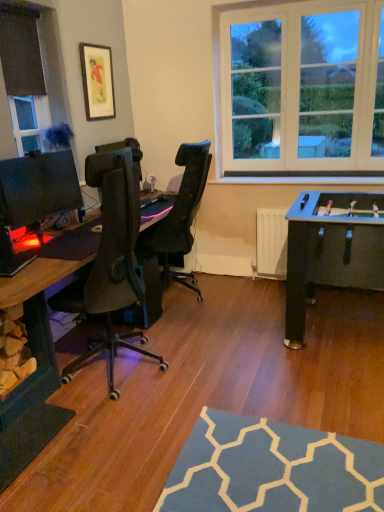
What do you see at coordinates (51, 264) in the screenshot? I see `matte black desk at left` at bounding box center [51, 264].

The image size is (384, 512). I want to click on matte gold picture frame at upper left, so click(x=97, y=81).

At what (x,y) coordinates should I click in order to perform the action: click on matte black monitor at left. Please return your answer as a coordinate pair (x, y). The image size is (384, 512). Looking at the image, I should click on (38, 188).

From a real-world perspective, is matte gold picture frame at upper left positioned under black fabric at upper left based on gravity?

Correct, in the physical world, matte gold picture frame at upper left is lower than black fabric at upper left.

Is matte gold picture frame at upper left aimed at black fabric at upper left?

No, matte gold picture frame at upper left is not aimed at black fabric at upper left.

What's the angular difference between matte gold picture frame at upper left and black fabric at upper left's facing directions?

They differ by 0.252 degrees in their facing directions.

Considering the relative sizes of black fabric at upper left and matte black desk at left in the image provided, is black fabric at upper left smaller than matte black desk at left?

Yes.

Do you think black fabric at upper left is within matte black desk at left, or outside of it?

black fabric at upper left lies outside matte black desk at left.

From the image's perspective, is black fabric at upper left located above or below matte black desk at left?

Clearly, from the image's perspective, black fabric at upper left is above matte black desk at left.

Would you say matte black monitor at left is to the left or to the right of matte black desk at left in the picture?

From the image, it's evident that matte black monitor at left is to the left of matte black desk at left.

Would you consider matte black monitor at left to be distant from matte black desk at left?

No, there isn't a large distance between matte black monitor at left and matte black desk at left.

Would you say matte black monitor at left is outside matte black desk at left?

Yes, matte black monitor at left is located beyond the bounds of matte black desk at left.

Consider the image. Does matte black desk at left have a lesser width compared to matte gold picture frame at upper left?

In fact, matte black desk at left might be wider than matte gold picture frame at upper left.

Between matte black desk at left and matte gold picture frame at upper left, which one is positioned behind?

matte gold picture frame at upper left is further from the camera.

At what (x,y) coordinates should I click in order to perform the action: click on computer desk that is under the matte gold picture frame at upper left (from a real-world perspective). Please return your answer as a coordinate pair (x, y). Looking at the image, I should click on (51, 264).

Is matte black monitor at left oriented towards matte gold picture frame at upper left?

No, matte black monitor at left is not turned towards matte gold picture frame at upper left.

Between matte black monitor at left and matte gold picture frame at upper left, which one has more height?

Standing taller between the two is matte gold picture frame at upper left.

From a real-world perspective, who is located lower, matte black monitor at left or matte gold picture frame at upper left?

matte black monitor at left, from a real-world perspective.

From the image's perspective, between matte black monitor at left and matte gold picture frame at upper left, which one is located above?

matte gold picture frame at upper left, from the image's perspective.

Which of these two, matte gold picture frame at upper left or matte black desk at left, is thinner?

matte gold picture frame at upper left is thinner.

Is matte gold picture frame at upper left closer to camera compared to matte black desk at left?

That is False.

From a real-world perspective, is matte gold picture frame at upper left below matte black desk at left?

Actually, matte gold picture frame at upper left is physically above matte black desk at left in the real world.

Can you confirm if matte gold picture frame at upper left is thinner than matte black monitor at left?

Yes, matte gold picture frame at upper left is thinner than matte black monitor at left.

Could you tell me if matte gold picture frame at upper left is turned towards matte black monitor at left?

No, matte gold picture frame at upper left does not turn towards matte black monitor at left.

Is matte gold picture frame at upper left next to matte black monitor at left?

They are not placed beside each other.

Can you confirm if matte gold picture frame at upper left is smaller than matte black monitor at left?

Yes.

You are a GUI agent. You are given a task and a screenshot of the screen. Output one action in this format:
    pyautogui.click(x=<x>, y=<y>)
    Task: Click on the picture frame directly beneath the black fabric at upper left (from a real-world perspective)
    Image resolution: width=384 pixels, height=512 pixels.
    Given the screenshot: What is the action you would take?
    pyautogui.click(x=97, y=81)

You are a GUI agent. You are given a task and a screenshot of the screen. Output one action in this format:
    pyautogui.click(x=<x>, y=<y>)
    Task: Click on the computer desk that appears on the right of black fabric at upper left
    The height and width of the screenshot is (512, 384).
    Given the screenshot: What is the action you would take?
    pyautogui.click(x=51, y=264)

Estimate the real-world distances between objects in this image. Which object is further from matte black desk at left, matte black monitor at left or matte gold picture frame at upper left?

matte gold picture frame at upper left.

Considering their positions, is matte gold picture frame at upper left positioned further to black fabric at upper left than matte black monitor at left?

matte black monitor at left is further to black fabric at upper left.

Which object lies further to the anchor point matte black desk at left, black fabric at upper left or matte black monitor at left?

Based on the image, black fabric at upper left appears to be further to matte black desk at left.

Looking at the image, which one is located closer to black fabric at upper left, matte black desk at left or matte black monitor at left?

Based on the image, matte black monitor at left appears to be nearer to black fabric at upper left.

Looking at the image, which one is located further to black fabric at upper left, matte black desk at left or matte gold picture frame at upper left?

Among the two, matte black desk at left is located further to black fabric at upper left.

Which object lies further to the anchor point matte black monitor at left, matte black desk at left or matte gold picture frame at upper left?

Based on the image, matte gold picture frame at upper left appears to be further to matte black monitor at left.

Based on their spatial positions, is matte gold picture frame at upper left or matte black desk at left further from black fabric at upper left?

matte black desk at left is further to black fabric at upper left.

Based on their spatial positions, is matte black desk at left or black fabric at upper left closer to matte black monitor at left?

matte black desk at left is closer to matte black monitor at left.

You are a GUI agent. You are given a task and a screenshot of the screen. Output one action in this format:
    pyautogui.click(x=<x>, y=<y>)
    Task: Click on the window frame between matte gold picture frame at upper left and matte black desk at left in the up-down direction
    
    Given the screenshot: What is the action you would take?
    pyautogui.click(x=20, y=50)

You are a GUI agent. You are given a task and a screenshot of the screen. Output one action in this format:
    pyautogui.click(x=<x>, y=<y>)
    Task: Click on the computer monitor that lies between black fabric at upper left and matte black desk at left from top to bottom
    
    Given the screenshot: What is the action you would take?
    pyautogui.click(x=38, y=188)

Where is `computer monitor between matte black desk at left and matte gold picture frame at upper left along the z-axis`? computer monitor between matte black desk at left and matte gold picture frame at upper left along the z-axis is located at coordinates (38, 188).

In order to click on window frame that lies between matte gold picture frame at upper left and matte black monitor at left from top to bottom in this screenshot , I will do `click(20, 50)`.